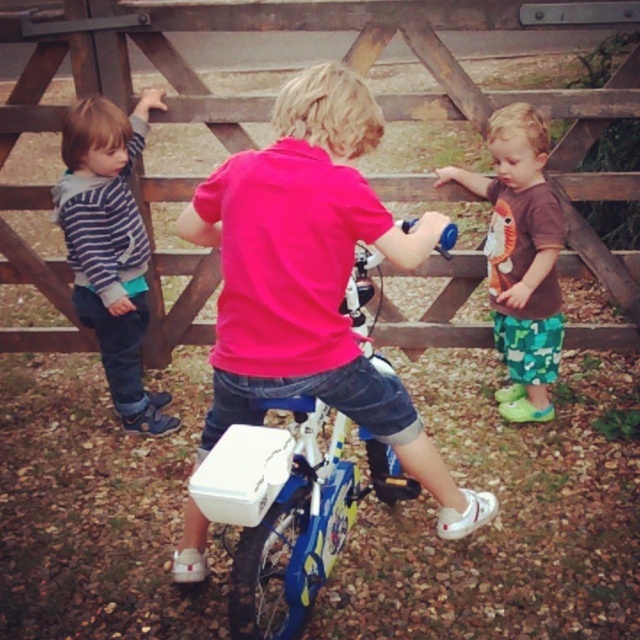
You are standing at the point marked by the coordinates point [356,68] in the image. What object is located exactly at this point?

The point [356,68] indicates the wooden fence at center.

You are a parent trying to ensure your child stays within the safe play area. The wooden fence at center marks the boundary. Based on the scene description, is the child riding the blue bicycle inside or outside the safe play area?

The wooden fence at center is located at point (356, 68), so the child riding the blue bicycle is inside the safe play area as the fence marks the boundary.

You are standing at the point labeled point [36,276] and want to walk to the point labeled point [333,548]. Which direction should you move in to get closer to your destination?

You should move away from the viewer since point [36,276] is closer to the viewer than point [333,548]. Moving away from the viewer will take you towards the point [333,548].